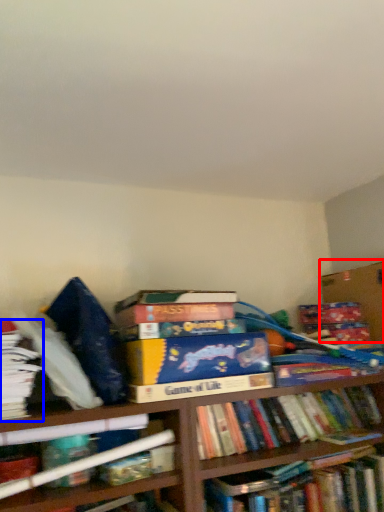
Question: Which object is closer to the camera taking this photo, cardboard box (highlighted by a red box) or book (highlighted by a blue box)?

Choices:
 (A) cardboard box
 (B) book

Answer: (B)